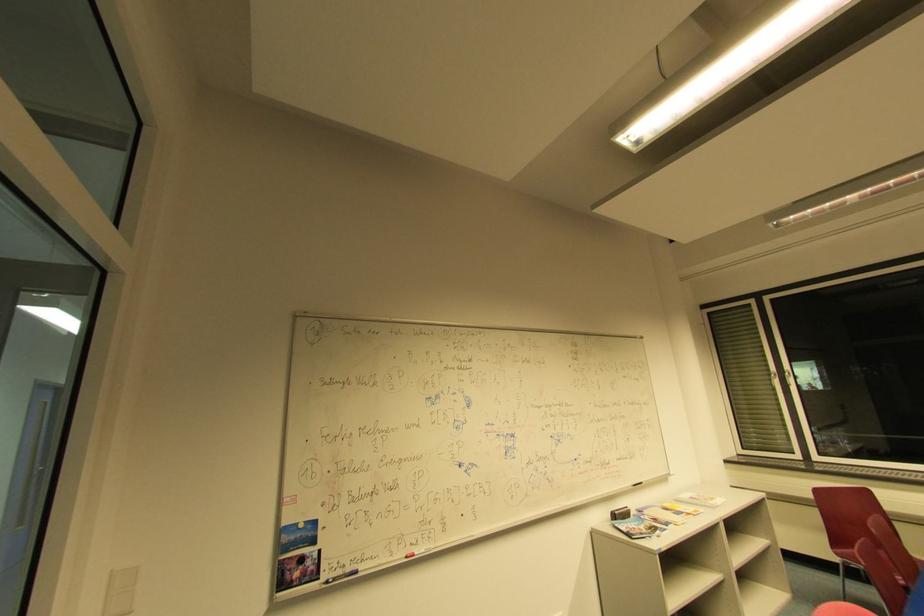
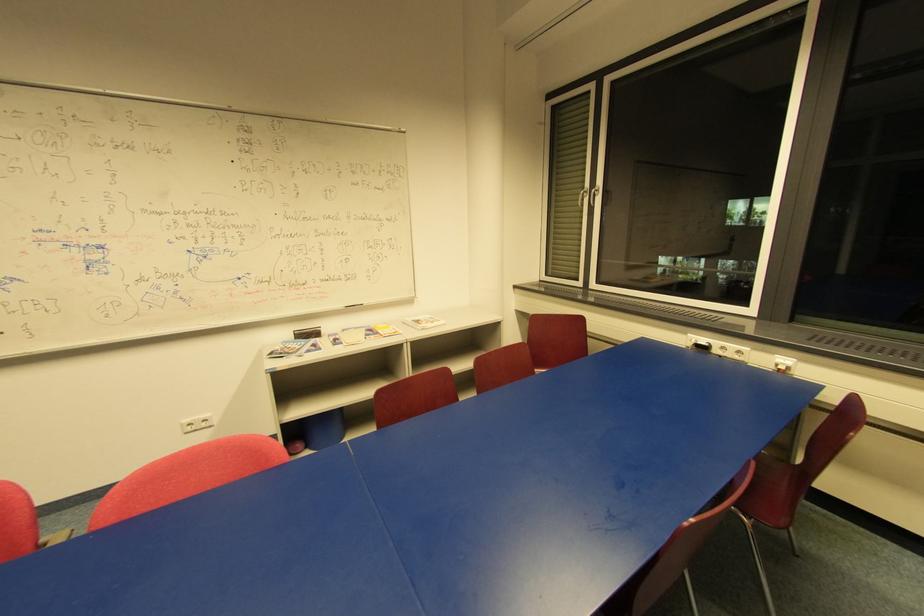
The point at (x=685, y=514) is marked in the first image. Where is the corresponding point in the second image?

(381, 334)